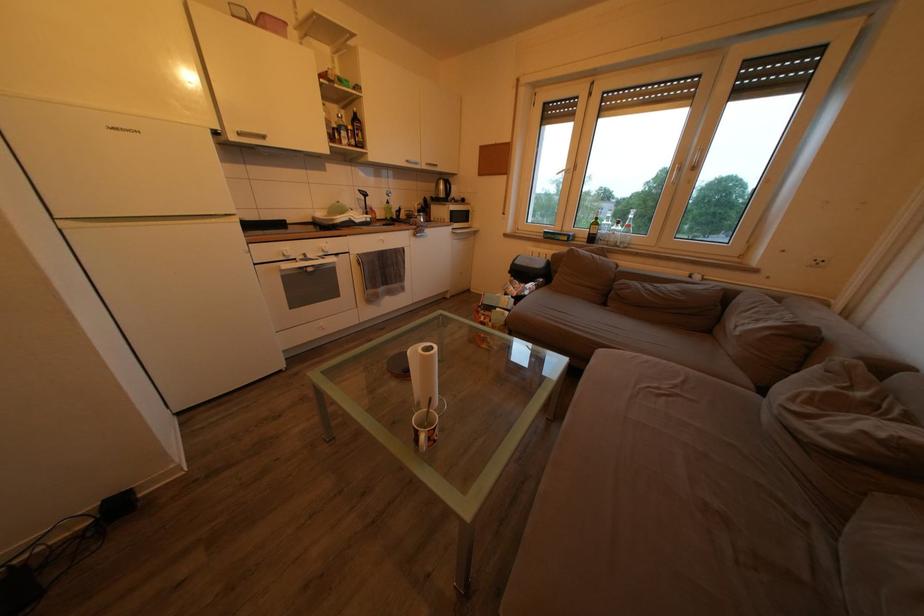
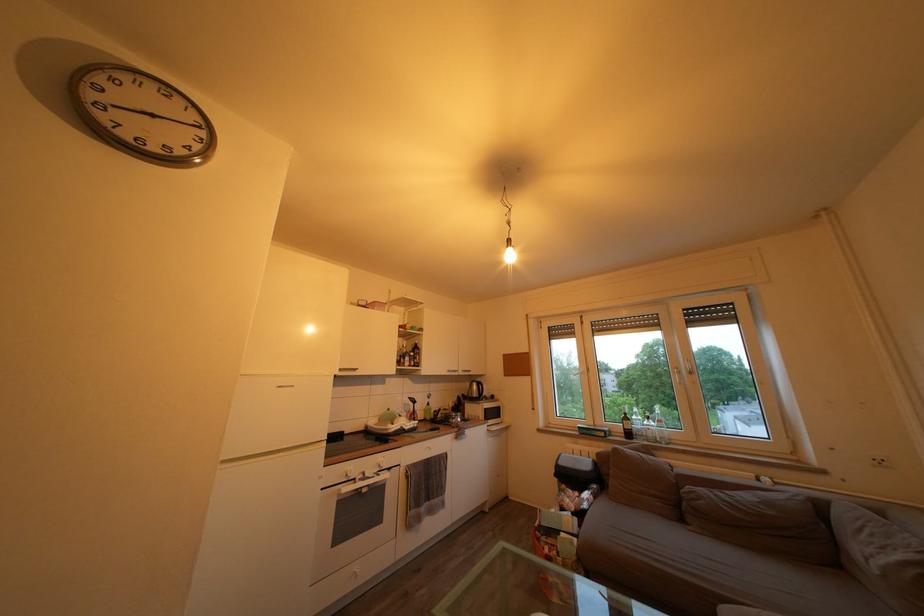
In the second image, find the point that corresponds to point (318, 262) in the first image.

(375, 480)